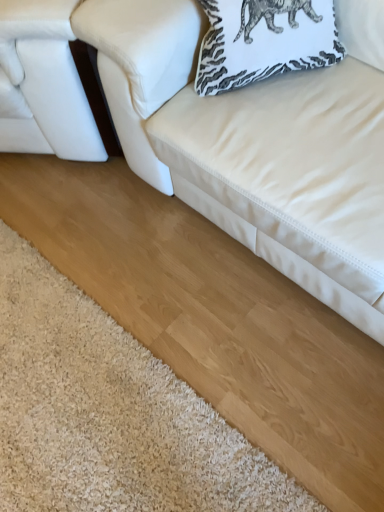
Question: From the image's perspective, is white leather couch at upper right, which is the 2th studio couch in left-to-right order, below white printed pillow at upper right?

Choices:
 (A) yes
 (B) no

Answer: (A)

Question: Can you confirm if white leather couch at upper right, which is the 2th studio couch in left-to-right order, is bigger than white printed pillow at upper right?

Choices:
 (A) no
 (B) yes

Answer: (B)

Question: Can you confirm if white leather couch at upper right, which is the 2th studio couch in left-to-right order, is smaller than white printed pillow at upper right?

Choices:
 (A) yes
 (B) no

Answer: (B)

Question: Is white leather couch at upper right, which is the 2th studio couch in left-to-right order, aimed at white printed pillow at upper right?

Choices:
 (A) yes
 (B) no

Answer: (A)

Question: From a real-world perspective, is white leather couch at upper right, the 1th studio couch viewed from the right, under white printed pillow at upper right?

Choices:
 (A) no
 (B) yes

Answer: (B)

Question: Is white leather couch at upper right, which is the 2th studio couch in left-to-right order, oriented away from white printed pillow at upper right?

Choices:
 (A) yes
 (B) no

Answer: (A)

Question: Can you confirm if white printed pillow at upper right is positioned to the right of white leather studio couch at left, which appears as the 2th studio couch when viewed from the right?

Choices:
 (A) yes
 (B) no

Answer: (A)

Question: Is white printed pillow at upper right at the left side of white leather studio couch at left, which is the first studio couch from left to right?

Choices:
 (A) yes
 (B) no

Answer: (B)

Question: Is white leather studio couch at left, which appears as the 2th studio couch when viewed from the right, at the back of white printed pillow at upper right?

Choices:
 (A) yes
 (B) no

Answer: (B)

Question: Does white printed pillow at upper right come behind white leather studio couch at left, which is the first studio couch from left to right?

Choices:
 (A) yes
 (B) no

Answer: (B)

Question: Is white leather studio couch at left, which is the first studio couch from left to right, completely or partially inside white printed pillow at upper right?

Choices:
 (A) yes
 (B) no

Answer: (B)

Question: Can you confirm if white printed pillow at upper right is bigger than white leather studio couch at left, which is the first studio couch from left to right?

Choices:
 (A) yes
 (B) no

Answer: (B)

Question: Is white printed pillow at upper right shorter than white leather couch at upper right, the 1th studio couch viewed from the right?

Choices:
 (A) yes
 (B) no

Answer: (A)